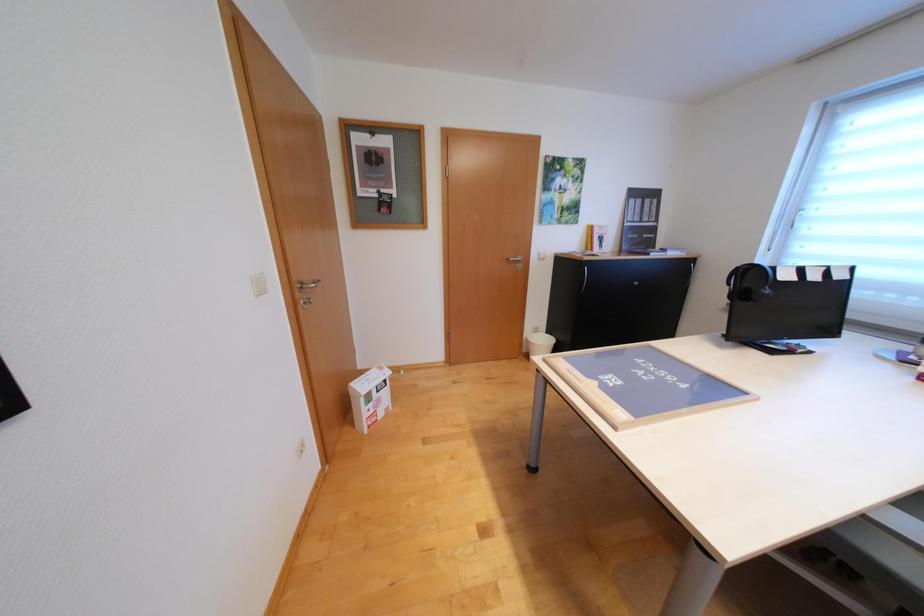
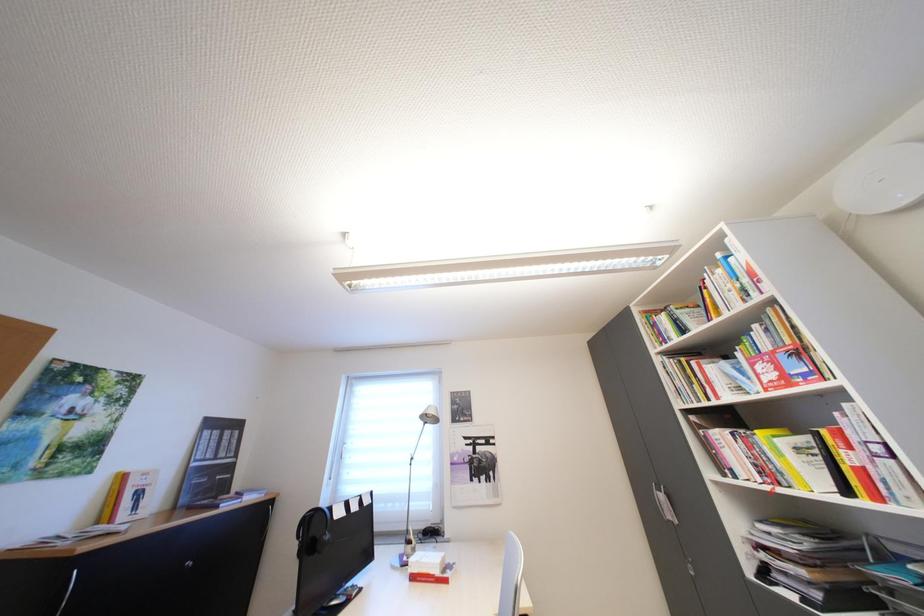
The first image is from the beginning of the video and the second image is from the end. How did the camera likely rotate when shooting the video?

The camera rotated toward right-up.